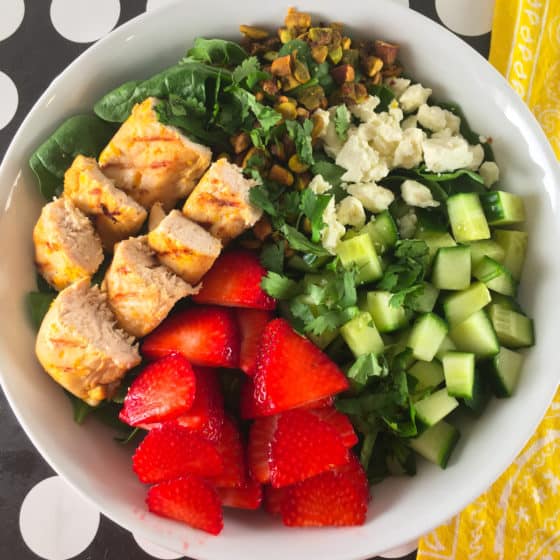
Locate an element on the screen. This screenshot has width=560, height=560. table is located at coordinates (24, 464).